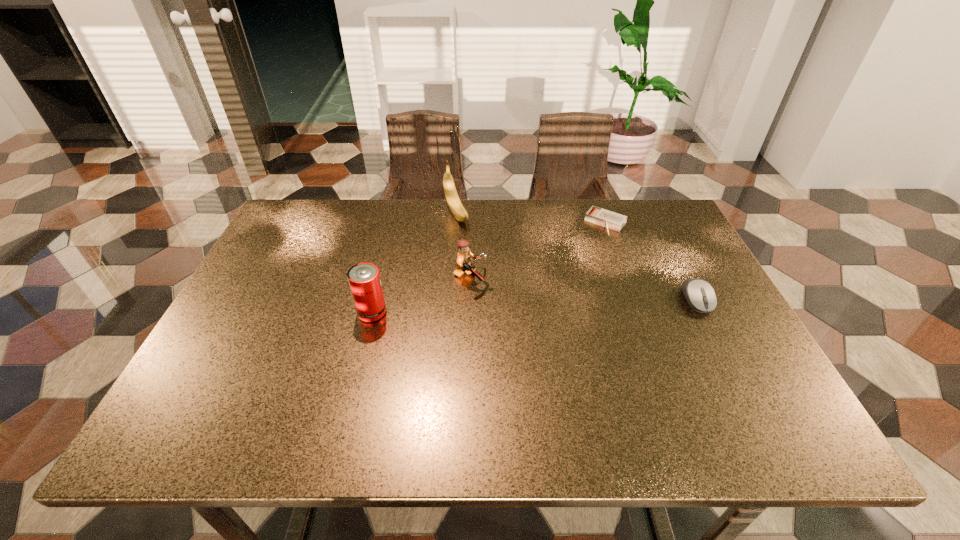
Locate an element on the screen. This screenshot has height=540, width=960. matchbox that is at the far edge is located at coordinates (606, 218).

The height and width of the screenshot is (540, 960). In order to click on computer equipment present at the right edge in this screenshot , I will do `click(700, 295)`.

This screenshot has width=960, height=540. Identify the location of matchbox that is positioned at the right edge. (606, 218).

Locate an element on the screen. This screenshot has width=960, height=540. object that is at the far right corner is located at coordinates (606, 218).

In the image, there is a desktop. At what (x,y) coordinates should I click in order to perform the action: click on free space at the far edge. Please return your answer as a coordinate pair (x, y). Looking at the image, I should click on (553, 211).

This screenshot has width=960, height=540. In the image, there is a desktop. What are the coordinates of `vacant space at the near edge` in the screenshot? It's located at (331, 374).

Locate an element on the screen. blank area at the left edge is located at coordinates (264, 280).

This screenshot has width=960, height=540. Identify the location of vacant space at the right edge of the desktop. (730, 359).

This screenshot has height=540, width=960. Identify the location of vacant space at the far left corner. (289, 220).

The height and width of the screenshot is (540, 960). Identify the location of vacant region at the near left corner of the desktop. (257, 377).